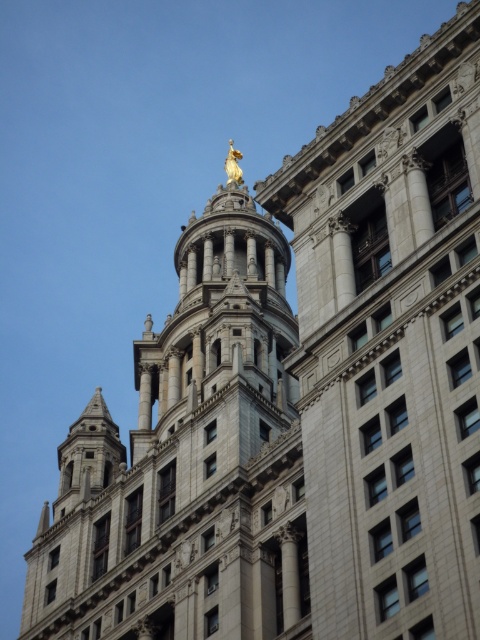
You are an architect assessing the building. You need to determine which object is taller between the gray stone tower at center and the gold polished statue at upper center. Based on the scene, which one is taller?

The gold polished statue at upper center is taller than the gray stone tower at center according to the description.

You are an architect examining the building. You notice the gray stone tower at center and the gold polished statue at upper center. Which object is closer to you from your current viewpoint?

The gray stone tower at center is closer to you because it is in front of the gold polished statue at upper center.

Based on the photo, you are standing outside the grand historic building and want to take a photo of the gray stone tower at center. If you are exactly 38.01 meters away from it, will the entire tower fit in your smartphone camera frame?

The gray stone tower at center and viewer are 38.01 meters apart. Whether the tower fits in the frame depends on the camera sensor size and lens focal length, which are not provided. However, at 38 meters, it might be challenging to capture the entire tower unless using a wide angle lens.